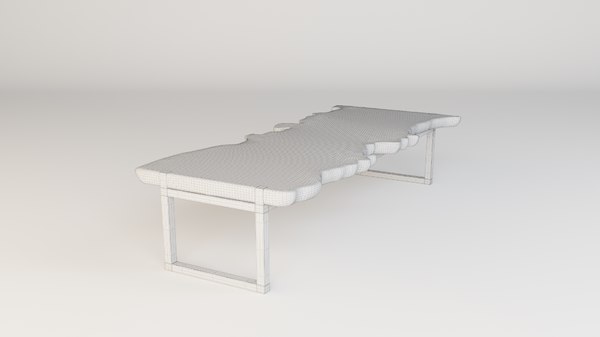
You are a GUI agent. You are given a task and a screenshot of the screen. Output one action in this format:
    pyautogui.click(x=<x>, y=<y>)
    Task: Click on the table
    
    Given the screenshot: What is the action you would take?
    pyautogui.click(x=314, y=147)